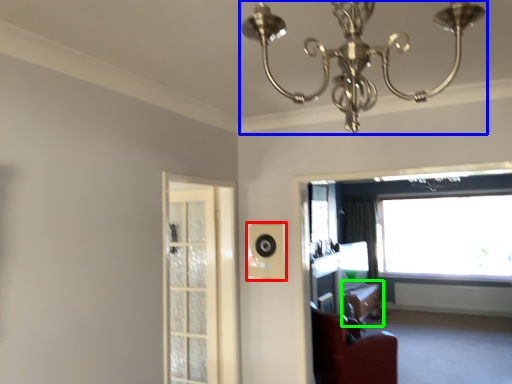
Question: Which is nearer to the speaker (highlighted by a red box)? lamp (highlighted by a blue box) or table (highlighted by a green box).

Choices:
 (A) lamp
 (B) table

Answer: (A)